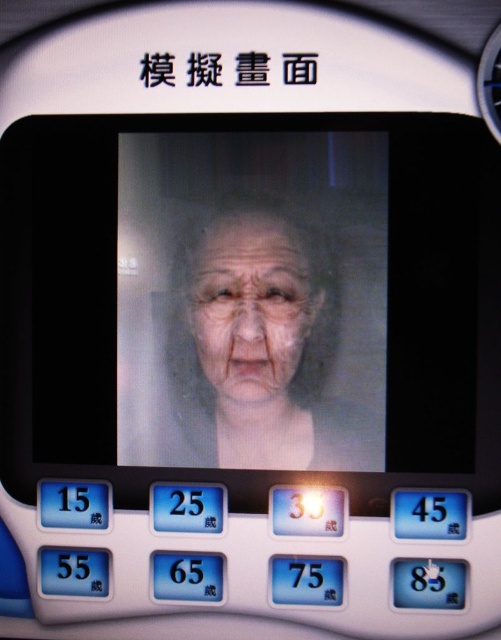
Question: Which of the following is the farthest from the observer?

Choices:
 (A) (x=281, y=288)
 (B) (x=243, y=244)

Answer: (B)

Question: Which object is farther from the camera taking this photo?

Choices:
 (A) smooth skin face at center
 (B) matte gray face at center

Answer: (A)

Question: Can you confirm if matte gray face at center is positioned below smooth skin face at center?

Choices:
 (A) yes
 (B) no

Answer: (A)

Question: Can you confirm if matte gray face at center is positioned below smooth skin face at center?

Choices:
 (A) yes
 (B) no

Answer: (A)

Question: Can you confirm if matte gray face at center is wider than smooth skin face at center?

Choices:
 (A) yes
 (B) no

Answer: (A)

Question: Among these objects, which one is nearest to the camera?

Choices:
 (A) matte gray face at center
 (B) smooth skin face at center

Answer: (A)